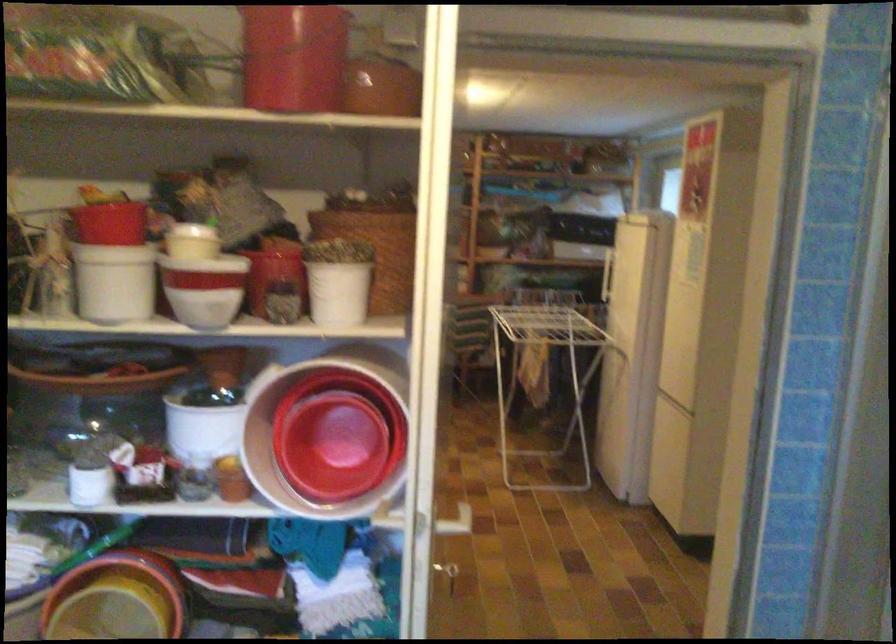
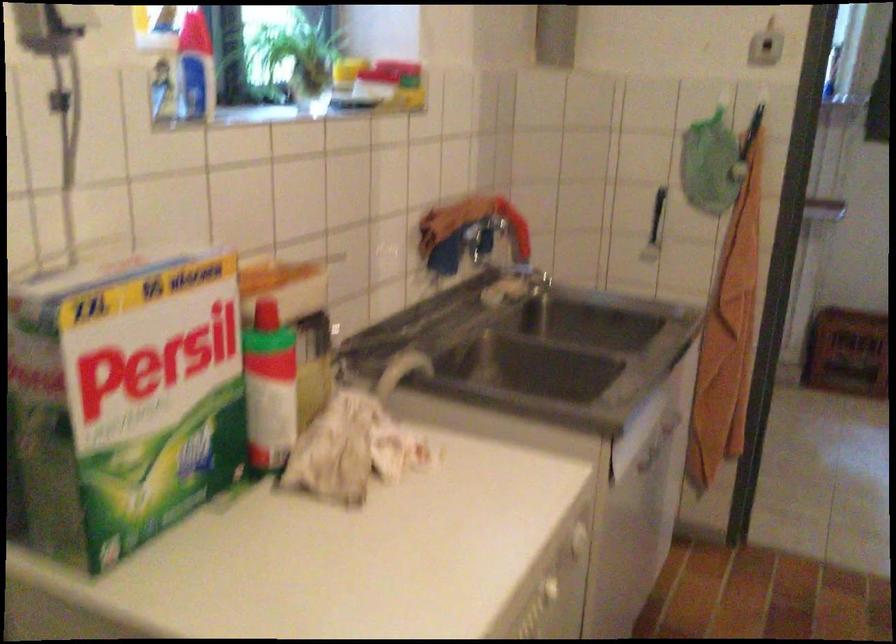
Based on the continuous images, in which direction is the camera rotating?

The rotation direction of the camera is left-down.